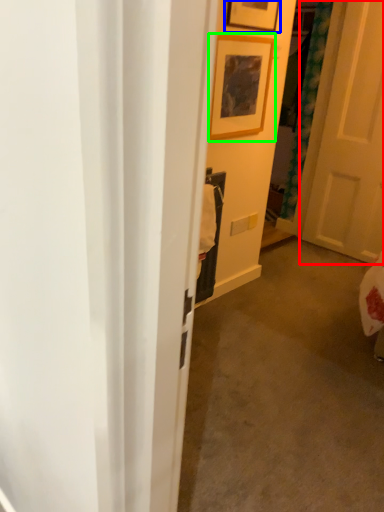
Question: Based on their relative distances, which object is farther from door (highlighted by a red box)? Choose from picture frame (highlighted by a blue box) and picture frame (highlighted by a green box).

Choices:
 (A) picture frame
 (B) picture frame

Answer: (A)